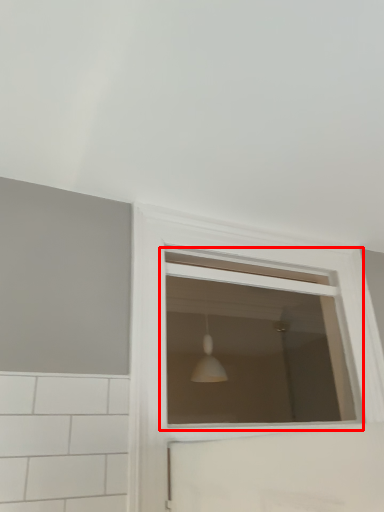
Question: Considering the relative positions of window (annotated by the red box) and window in the image provided, where is window (annotated by the red box) located with respect to the staircase?

Choices:
 (A) right
 (B) left

Answer: (B)